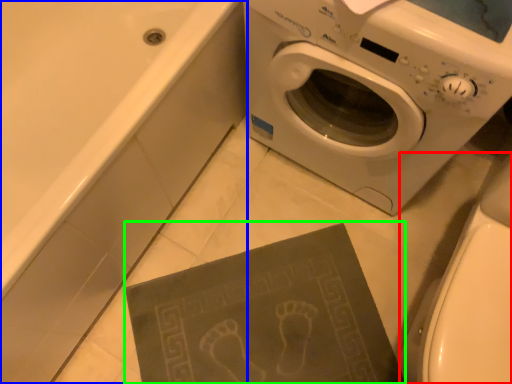
Question: Which object is positioned farthest from toilet bowl (highlighted by a red box)? Select from bath (highlighted by a blue box) and paperback book (highlighted by a green box).

Choices:
 (A) bath
 (B) paperback book

Answer: (A)